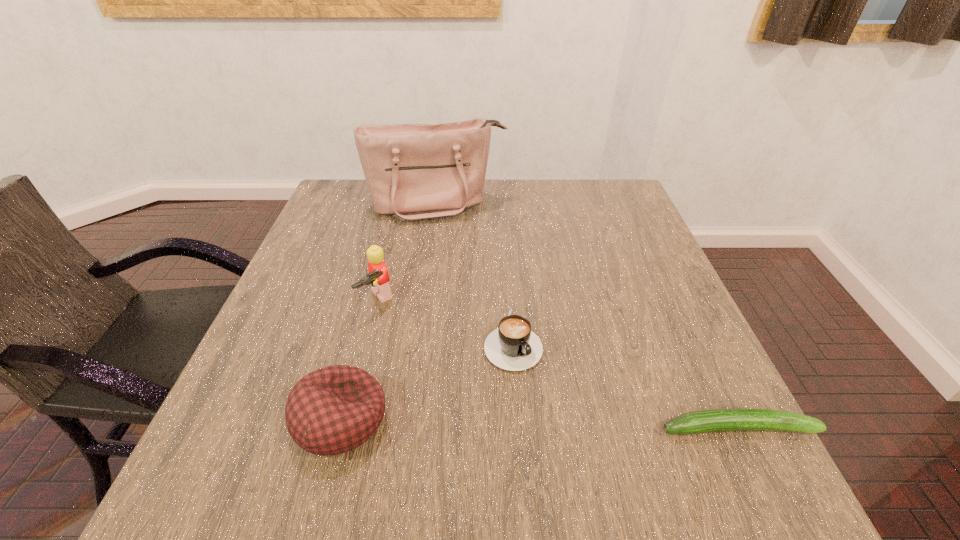
Locate an element on the screen. This screenshot has height=540, width=960. free space on the desktop that is between the third tallest object and the rightmost object and is positioned with the handle on the side of the fourth tallest object is located at coordinates (574, 424).

The height and width of the screenshot is (540, 960). I want to click on vacant space on the desktop that is between the third tallest object and the zucchini and is positioned on the front pocket of the farthest object, so click(x=487, y=423).

Find the location of `free space on the desktop that is between the beanbag and the zucchini and is positioned in front of the second tallest object with the accessory visible`. free space on the desktop that is between the beanbag and the zucchini and is positioned in front of the second tallest object with the accessory visible is located at coordinates (484, 423).